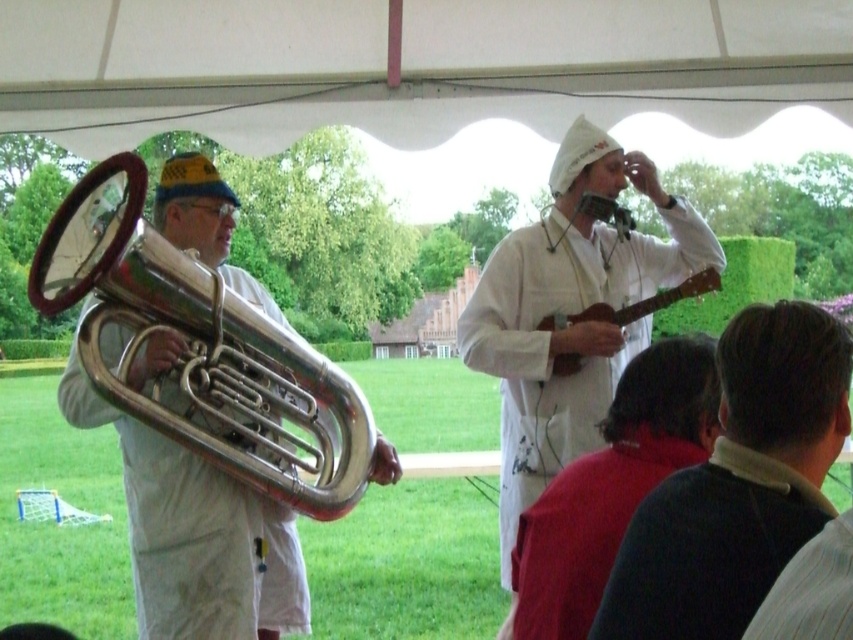
Question: Is polished silver trumpet at left to the left of dark blue sweater at lower right from the viewer's perspective?

Choices:
 (A) yes
 (B) no

Answer: (A)

Question: Based on their relative distances, which object is farther from the wooden acoustic guitar at center?

Choices:
 (A) dark blue sweater at lower right
 (B) white matte guitar at upper center
 (C) polished silver trumpet at left

Answer: (A)

Question: Is dark blue sweater at lower right wider than white matte guitar at upper center?

Choices:
 (A) no
 (B) yes

Answer: (A)

Question: Is polished silver trumpet at left in front of wooden acoustic guitar at center?

Choices:
 (A) yes
 (B) no

Answer: (A)

Question: Which point appears farthest from the camera in this image?

Choices:
 (A) (485, 307)
 (B) (546, 324)

Answer: (A)

Question: Which object is the farthest from the dark blue sweater at lower right?

Choices:
 (A) polished silver trumpet at left
 (B) white matte guitar at upper center
 (C) wooden acoustic guitar at center

Answer: (A)